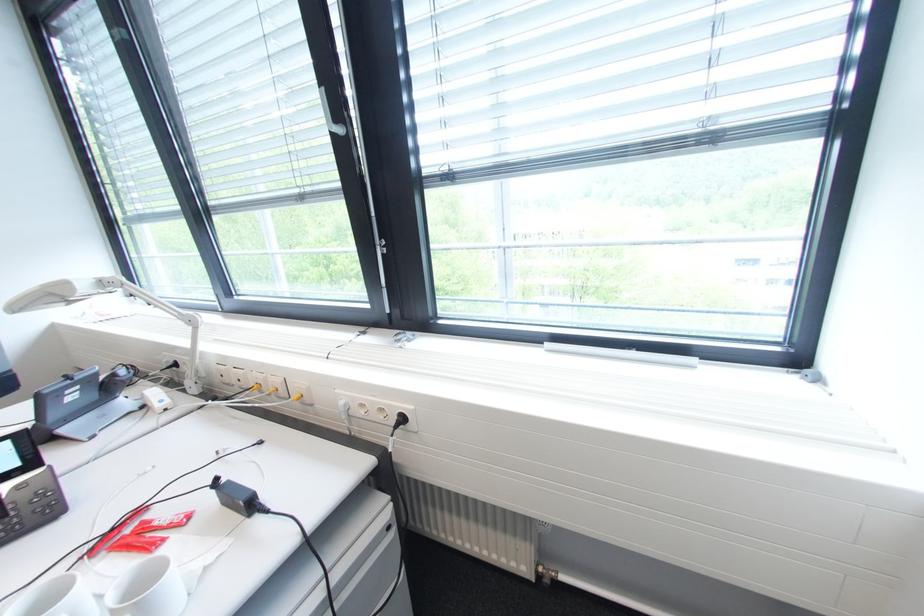
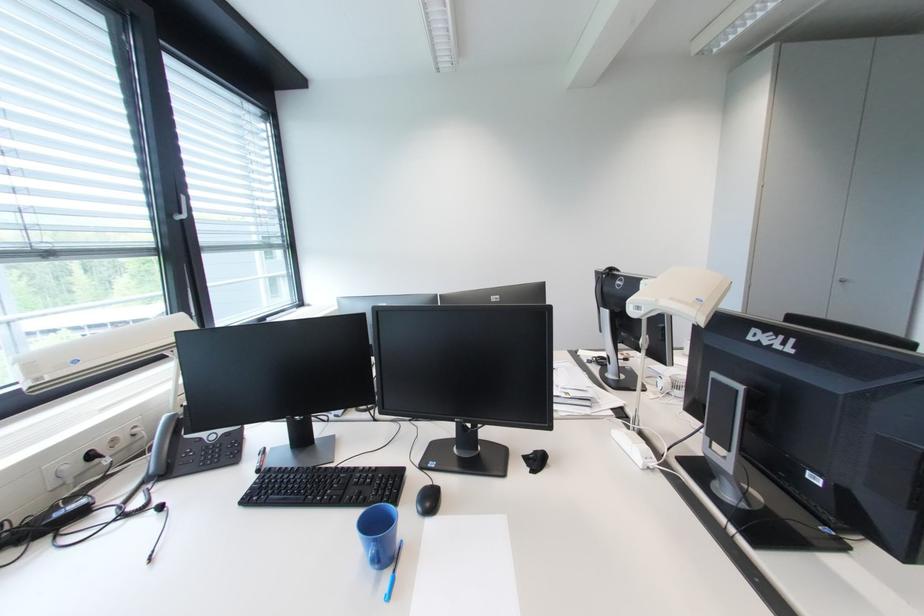
Question: I am providing you with two images of the same scene from different viewpoints. After the viewpoint changes to image2, which objects are now occluded?

Choices:
 (A) blue push-pin magnet
 (B) white window handle
 (C) telephone handset
 (D) white coffee mug

Answer: (D)